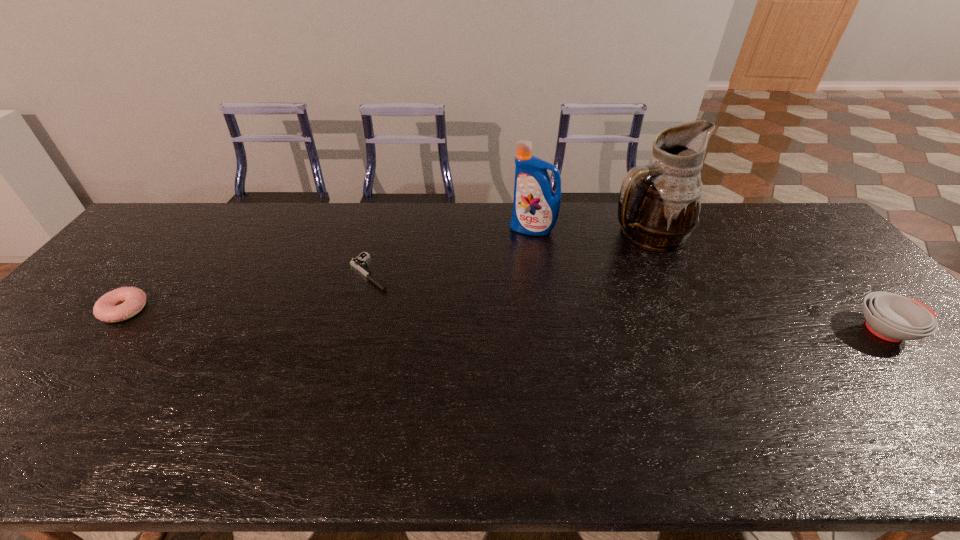
Locate an element on the screen. This screenshot has width=960, height=540. vacant space on the desktop that is between the leftmost object and the rightmost object and is positioned on the label of the detergent is located at coordinates (467, 319).

At what (x,y) coordinates should I click in order to perform the action: click on free space on the desktop that is between the doughnut and the third shortest object and is positioned from the spout of the pitcher. Please return your answer as a coordinate pair (x, y). Looking at the image, I should click on (612, 323).

The height and width of the screenshot is (540, 960). I want to click on vacant space on the desktop that is between the doughnut and the rightmost object and is positioned on the front-facing side of the pistol, so click(426, 318).